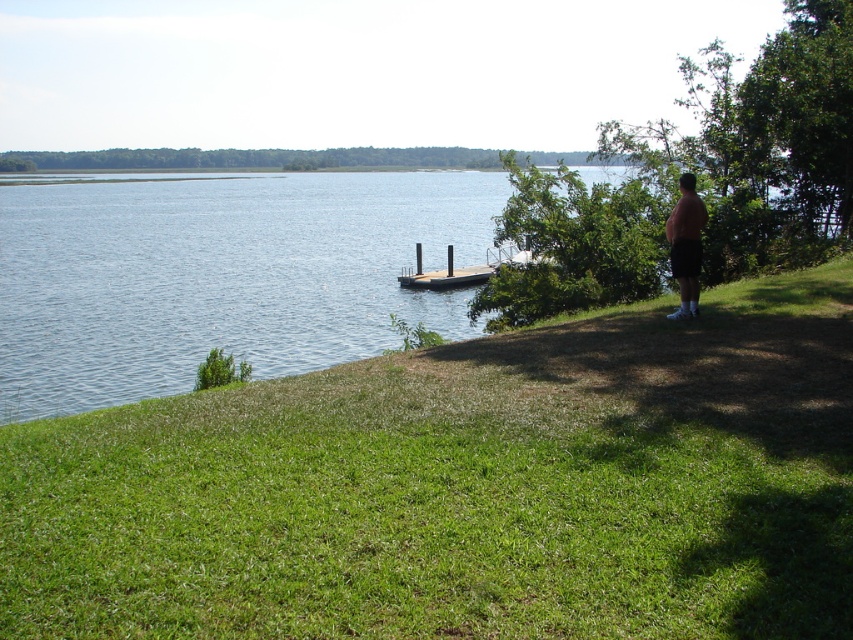
You are a photographer trying to capture the pink cotton shirt at right and the wooden dock at center in the same frame. Given their sizes, which object should you focus on first to ensure both fit clearly in the photo?

The pink cotton shirt at right has a smaller size compared to the wooden dock at center, so you should focus on the wooden dock at center first to ensure it is clear, then adjust the framing to include the smaller pink cotton shirt at right.

You are standing at the edge of the lake and want to walk towards the pink cotton shirt at right without stepping on the green grassy at lower left. Is this possible?

The green grassy at lower left might be wider than pink cotton shirt at right, so there may not be enough space to walk around it without stepping on the grass. It is uncertain if this path is feasible.